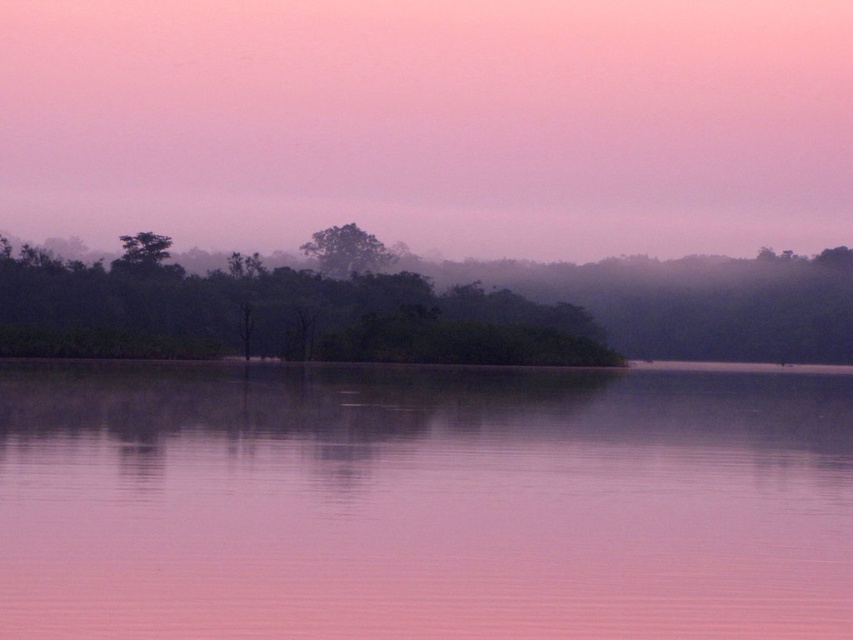
Question: Can you confirm if pink smooth water at center is wider than green matte tree at center?

Choices:
 (A) no
 (B) yes

Answer: (B)

Question: Can you confirm if misty purple sky at upper center is positioned to the left of green matte island at center?

Choices:
 (A) yes
 (B) no

Answer: (A)

Question: Which point is farther to the camera?

Choices:
 (A) (756, 108)
 (B) (538, 362)
 (C) (714, 545)

Answer: (A)

Question: Among these objects, which one is nearest to the camera?

Choices:
 (A) pink smooth water at center
 (B) misty purple sky at upper center
 (C) green matte island at center
 (D) green matte tree at center

Answer: (A)

Question: Is green matte island at center above green matte tree at center?

Choices:
 (A) yes
 (B) no

Answer: (B)

Question: Among these points, which one is nearest to the camera?

Choices:
 (A) (448, 392)
 (B) (612, 305)
 (C) (341, 269)
 (D) (602, 129)

Answer: (A)